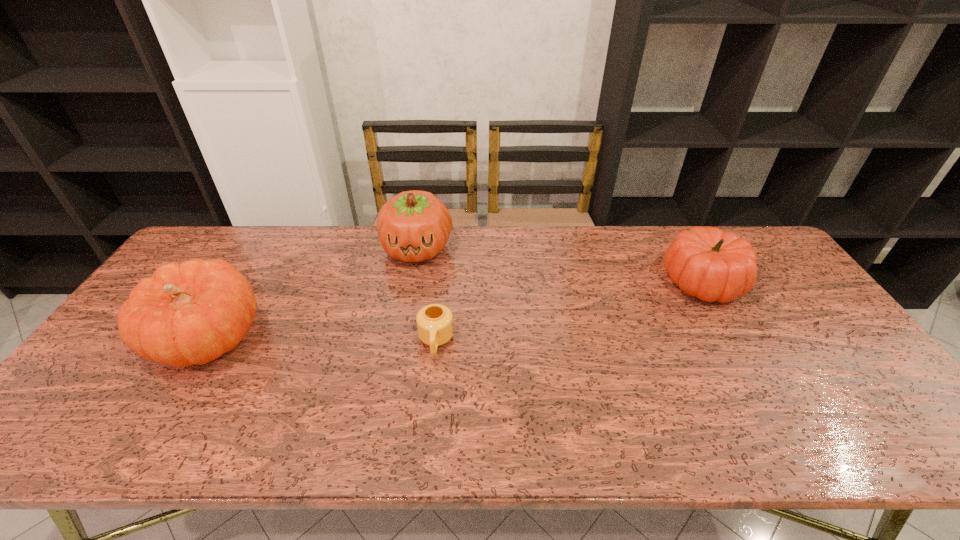
This screenshot has height=540, width=960. I want to click on empty space between the leftmost pumpkin and the second shortest object, so click(455, 310).

What are the coordinates of `free area in between the second pumpkin from right to left and the leftmost object` in the screenshot? It's located at (312, 294).

Locate an element on the screen. free space between the shortest pumpkin and the shortest object is located at coordinates 569,312.

I want to click on free space between the leftmost pumpkin and the shortest pumpkin, so click(x=455, y=310).

Identify the location of free spot between the leftmost object and the rightmost object. (455, 310).

The image size is (960, 540). I want to click on vacant space that is in between the leftmost pumpkin and the second pumpkin from left to right, so click(x=312, y=294).

Identify the location of object that is the nearest to the shortest object. This screenshot has height=540, width=960. (413, 226).

Locate an element on the screen. the third closest object to the second pumpkin from right to left is located at coordinates (707, 263).

This screenshot has height=540, width=960. I want to click on pumpkin that is the second closest to the mug, so click(x=191, y=313).

Select which pumpkin appears as the closest to the second pumpkin from right to left. Please provide its 2D coordinates. Your answer should be formatted as a tuple, i.e. [(x, y)], where the tuple contains the x and y coordinates of a point satisfying the conditions above.

[(191, 313)]